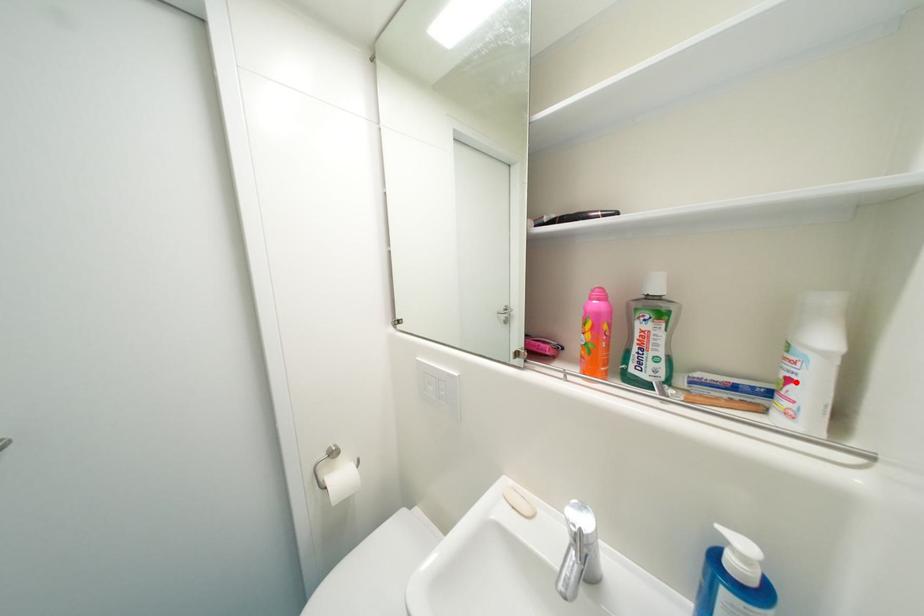
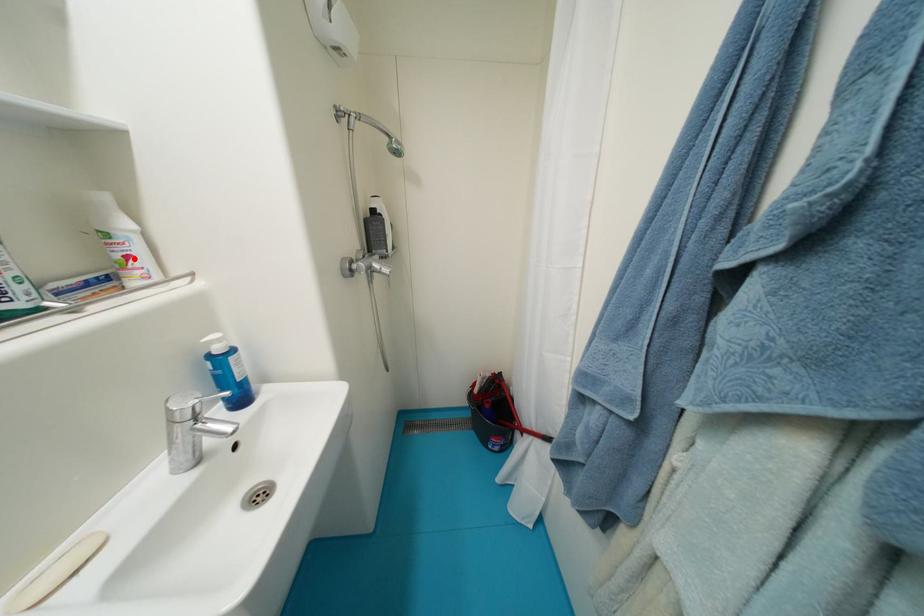
I am providing you with two images of the same scene from different viewpoints. A red point is marked on the first image and another point is marked on the second image. Are the points marked in image1 and image2 representing the same 3D position?

Yes